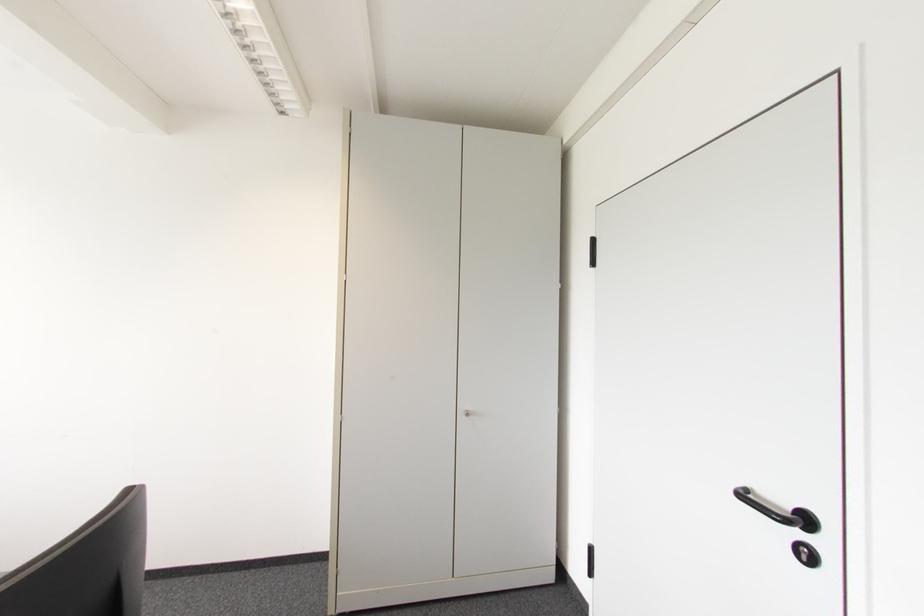
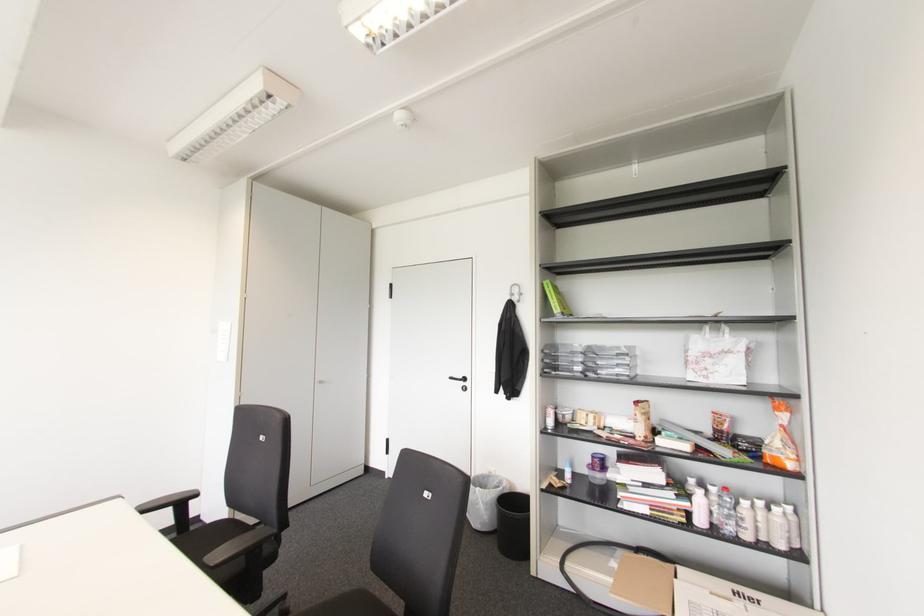
Find the pixel in the second image that matches point 805,521 in the first image.

(464, 379)